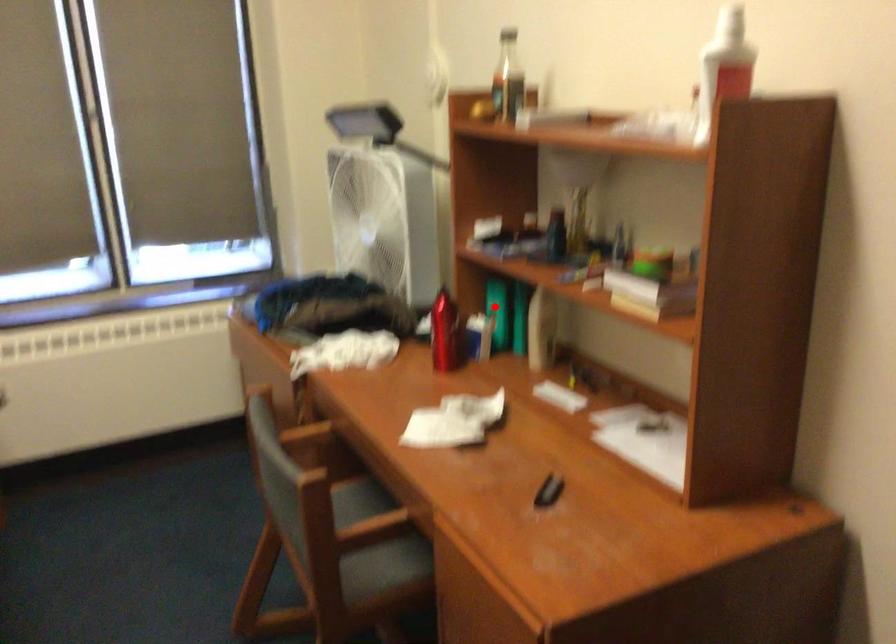
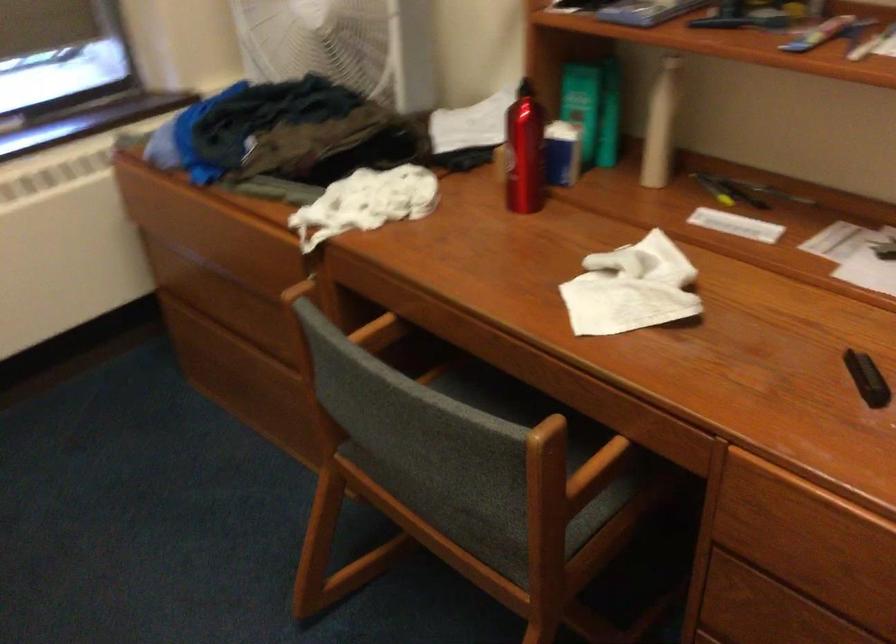
Question: I am providing you with two images of the same scene from different viewpoints. Image1 has a red point marked. In image2, the corresponding 3D location appears at what relative position? Reply with the corresponding letter.

Choices:
 (A) Closer
 (B) Farther

Answer: (A)